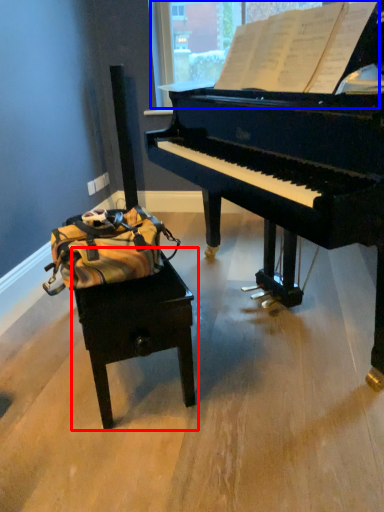
Question: Among these objects, which one is nearest to the camera, table (highlighted by a red box) or window screen (highlighted by a blue box)?

Choices:
 (A) table
 (B) window screen

Answer: (B)